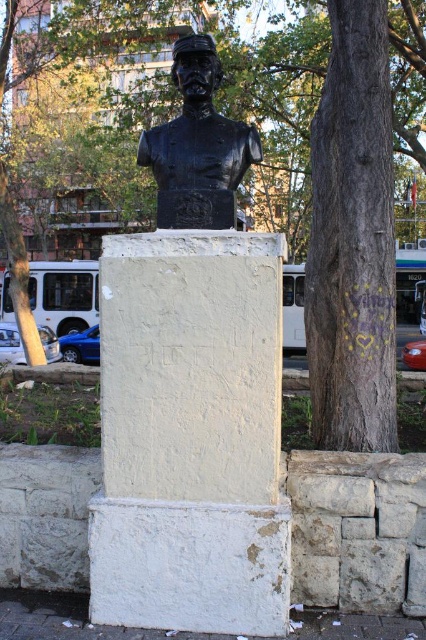
Question: Is black polished bust at center bigger than black bronze bust at center?

Choices:
 (A) yes
 (B) no

Answer: (A)

Question: Is green textured tree at center right positioned before black bronze bust at center?

Choices:
 (A) no
 (B) yes

Answer: (A)

Question: Which object is farther from the camera taking this photo?

Choices:
 (A) green textured tree at center right
 (B) black bronze bust at center
 (C) black polished bust at center

Answer: (A)

Question: Which point is farther to the camera?

Choices:
 (A) black bronze bust at center
 (B) black polished bust at center

Answer: (A)

Question: Which of the following is the farthest from the observer?

Choices:
 (A) black polished bust at center
 (B) green textured tree at center right

Answer: (B)

Question: Observing the image, what is the correct spatial positioning of black polished bust at center in reference to green textured tree at center right?

Choices:
 (A) above
 (B) below

Answer: (B)